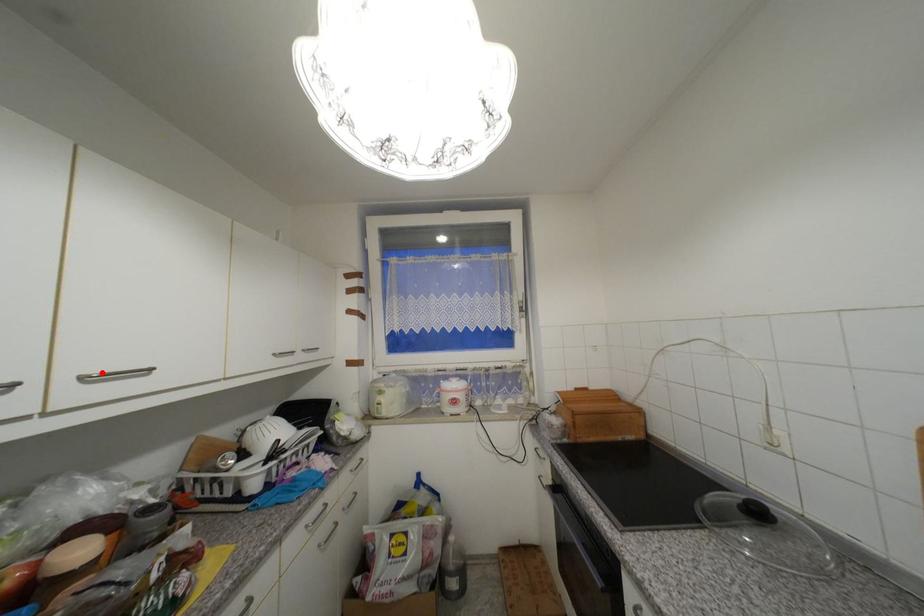
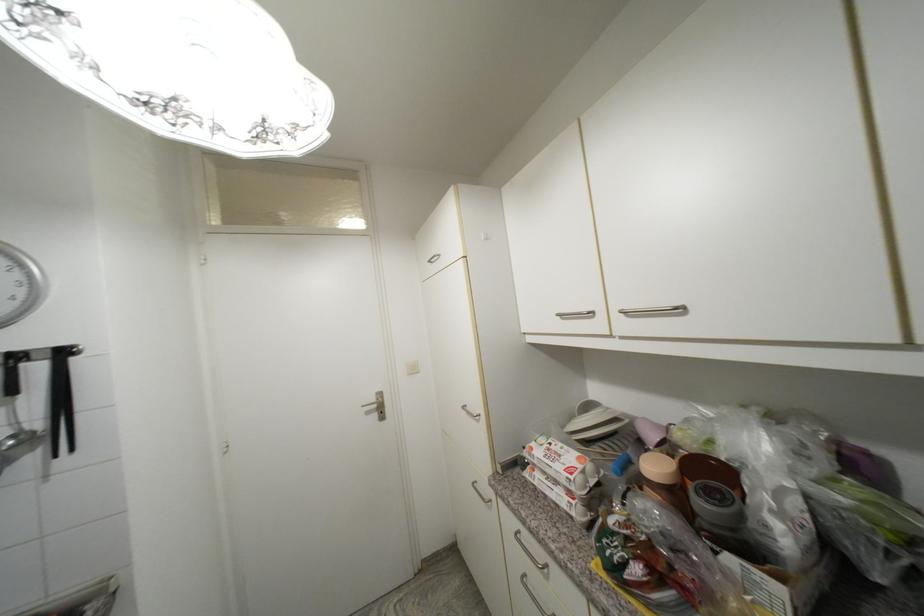
Where in the second image is the point corresponding to the highlighted location from the first image?

(631, 309)